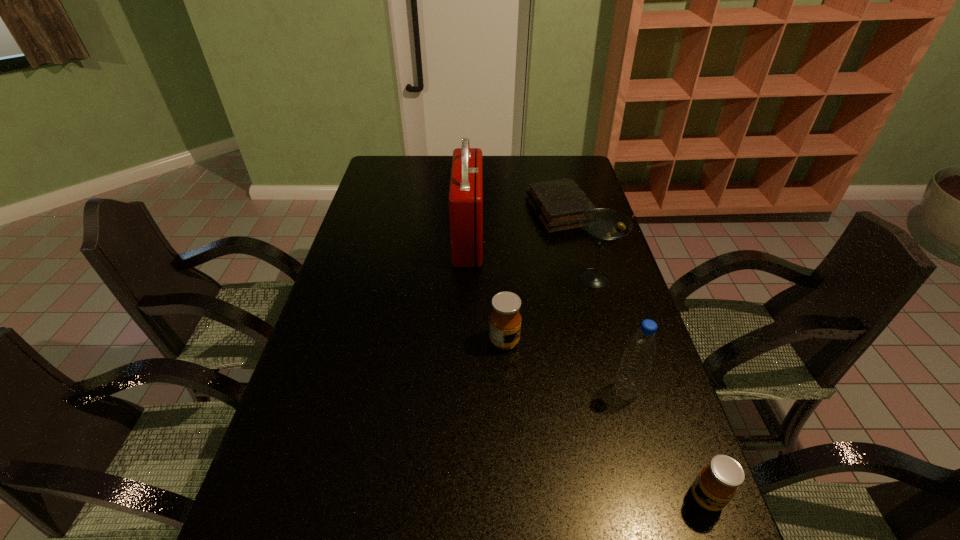
Identify the location of vacant space at the far edge of the desktop. The width and height of the screenshot is (960, 540). (538, 171).

I want to click on blank space at the near edge of the desktop, so click(x=349, y=518).

Find the location of a particular element. vacant area at the left edge of the desktop is located at coordinates (349, 320).

In the image, there is a desktop. At what (x,y) coordinates should I click in order to perform the action: click on vacant space at the right edge. Please return your answer as a coordinate pair (x, y). The image size is (960, 540). Looking at the image, I should click on (588, 301).

I want to click on vacant position at the near left corner of the desktop, so coord(252,522).

The height and width of the screenshot is (540, 960). In the image, there is a desktop. In order to click on vacant space at the far right corner in this screenshot , I will do `click(550, 169)`.

Find the location of a particular element. free space between the book and the third shortest object is located at coordinates (532, 276).

Find the location of `free space between the book and the water bottle`. free space between the book and the water bottle is located at coordinates (592, 301).

Locate an element on the screen. Image resolution: width=960 pixels, height=540 pixels. unoccupied position between the shortest object and the water bottle is located at coordinates (592, 301).

This screenshot has width=960, height=540. I want to click on unoccupied position between the shorter honey and the fifth farthest object, so click(666, 444).